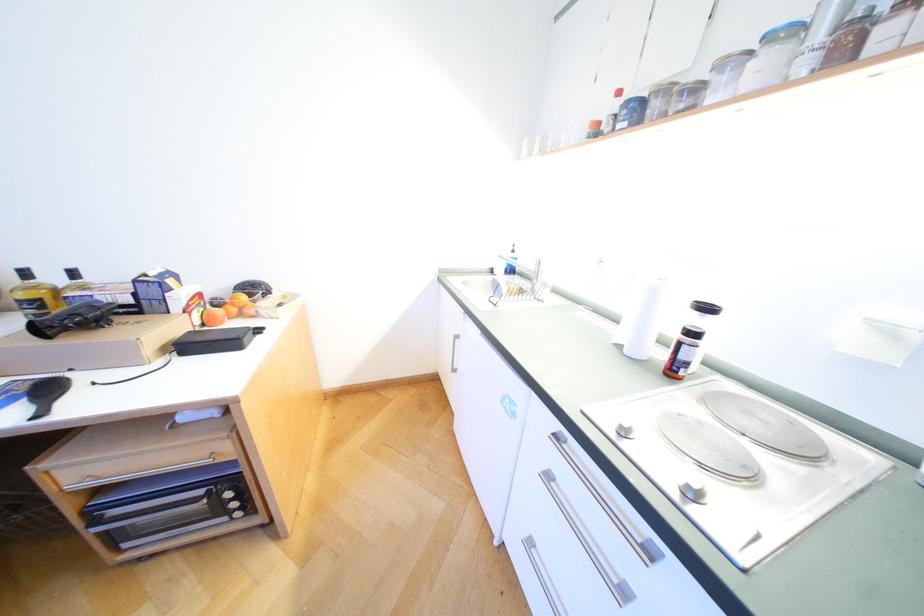
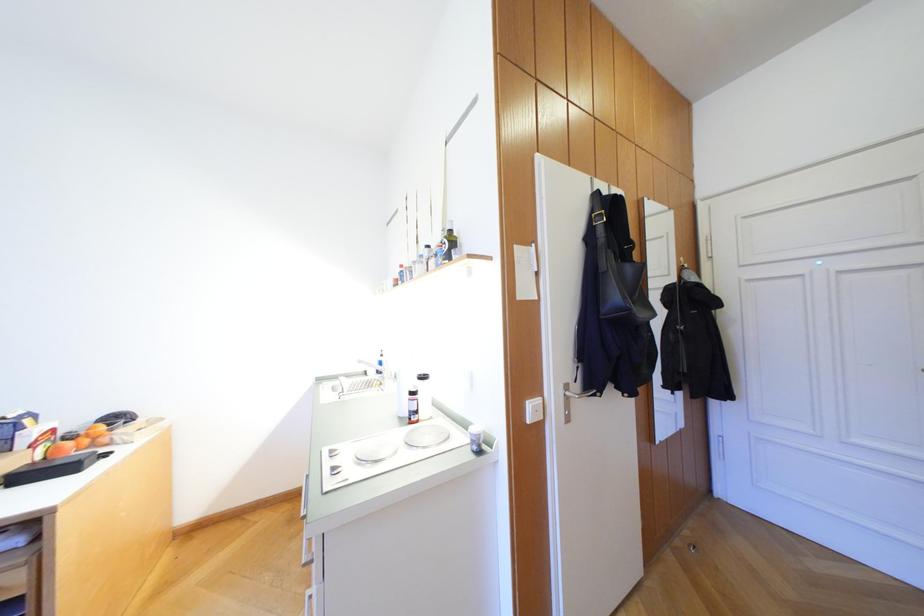
Question: The first image is from the beginning of the video and the second image is from the end. How did the camera likely rotate when shooting the video?

Choices:
 (A) Left
 (B) Right
 (C) Up
 (D) Down

Answer: (C)